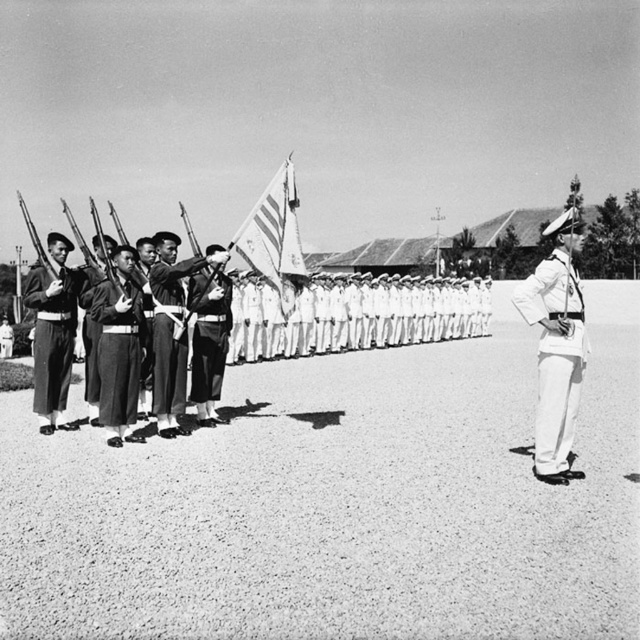
Question: Can you confirm if uniformed soldier at center is positioned below striped fabric flag at center?

Choices:
 (A) yes
 (B) no

Answer: (A)

Question: Which point is farther to the camera?

Choices:
 (A) (264, 220)
 (B) (170, 253)
 (C) (212, 252)

Answer: (C)

Question: Is white cotton uniform at right above dark gray fabric uniform at left?

Choices:
 (A) yes
 (B) no

Answer: (A)

Question: Is uniformed soldier at center to the right of dark gray woolen jacket at center from the viewer's perspective?

Choices:
 (A) yes
 (B) no

Answer: (A)

Question: Among these objects, which one is farthest from the camera?

Choices:
 (A) white cotton uniform at right
 (B) smooth dark uniform at center

Answer: (B)

Question: Which of the following is the farthest from the observer?

Choices:
 (A) dark gray woolen jacket at center
 (B) dark gray fabric uniform at left
 (C) white cotton uniform at right
 (D) smooth dark uniform at center

Answer: (D)